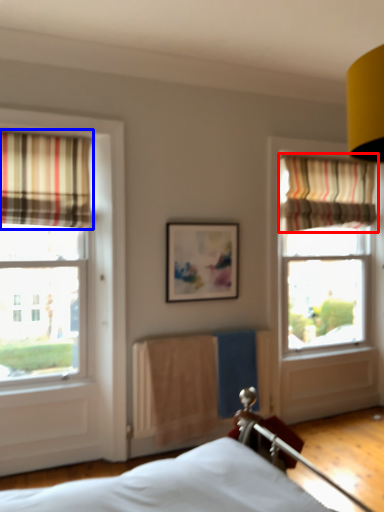
Question: Which point is closer to the camera, curtain (highlighted by a red box) or curtain (highlighted by a blue box)?

Choices:
 (A) curtain
 (B) curtain

Answer: (B)